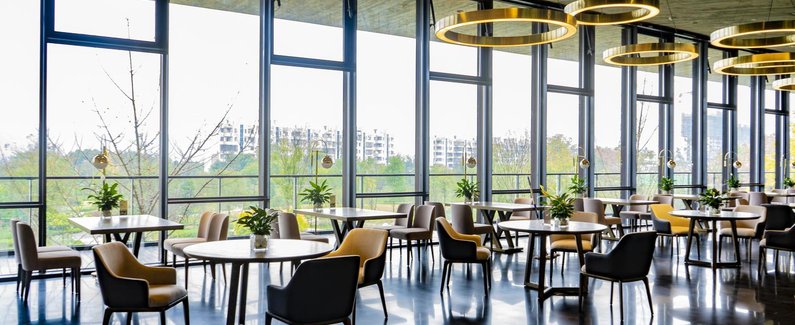
Identify the location of tables. The height and width of the screenshot is (325, 795). (136, 220), (230, 257), (344, 210), (503, 207), (518, 228), (621, 202), (684, 194), (777, 194), (731, 215).